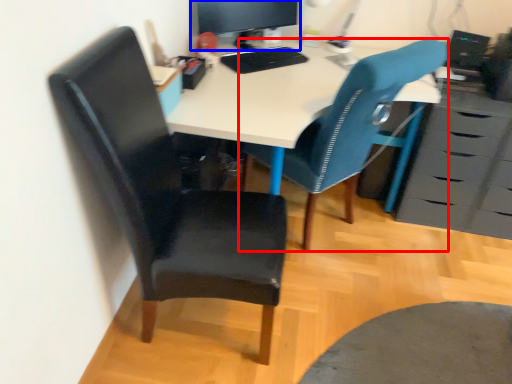
Question: Which object appears closest to the camera in this image, chair (highlighted by a red box) or computer monitor (highlighted by a blue box)?

Choices:
 (A) chair
 (B) computer monitor

Answer: (A)